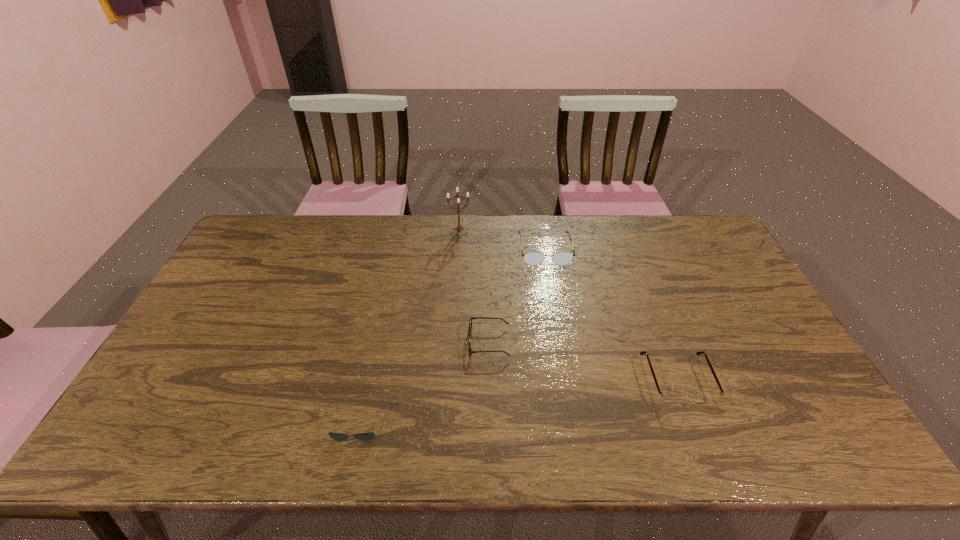
You are a GUI agent. You are given a task and a screenshot of the screen. Output one action in this format:
    pyautogui.click(x=<x>, y=<y>)
    Task: Click on the vacant position located 0.100m on the front-facing side of the shortest spectacles
    Image resolution: width=960 pixels, height=540 pixels.
    Given the screenshot: What is the action you would take?
    pyautogui.click(x=432, y=342)

Where is `vacant area situated on the front-facing side of the shortest spectacles`? The image size is (960, 540). vacant area situated on the front-facing side of the shortest spectacles is located at coordinates click(374, 342).

The image size is (960, 540). In order to click on candle holder at the far edge in this screenshot , I will do `click(459, 228)`.

At what (x,y) coordinates should I click in order to perform the action: click on spectacles positioned at the far edge. Please return your answer as a coordinate pair (x, y). The image size is (960, 540). Looking at the image, I should click on (532, 258).

Locate an element on the screen. This screenshot has width=960, height=540. object at the near edge is located at coordinates (368, 436).

You are a GUI agent. You are given a task and a screenshot of the screen. Output one action in this format:
    pyautogui.click(x=<x>, y=<y>)
    Task: Click on the vacant space at the far edge
    The image size is (960, 540).
    Given the screenshot: What is the action you would take?
    pyautogui.click(x=440, y=253)

Locate an element on the screen. vacant region at the near edge of the desktop is located at coordinates (381, 424).

Locate an element on the screen. The height and width of the screenshot is (540, 960). free space at the left edge is located at coordinates (200, 314).

This screenshot has height=540, width=960. I want to click on free space at the far left corner, so click(x=266, y=234).

At what (x,y) coordinates should I click in order to perform the action: click on free space between the leftmost spectacles and the candle holder. Please return your answer as a coordinate pair (x, y). The height and width of the screenshot is (540, 960). Looking at the image, I should click on (474, 288).